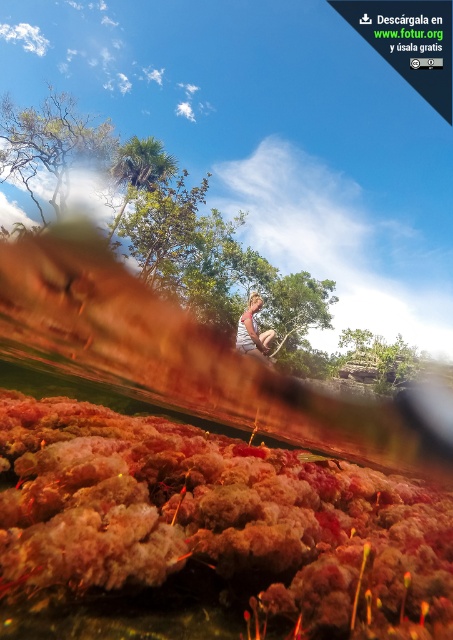
Question: Which object is farther from the camera taking this photo?

Choices:
 (A) fuzzy coral at bottom
 (B) green leafy tree at upper left
 (C) light brown hair at center
 (D) green leafy tree at upper center

Answer: (B)

Question: Which object is positioned farthest from the light brown hair at center?

Choices:
 (A) fuzzy coral at bottom
 (B) green leafy tree at upper center
 (C) green leafy tree at upper left

Answer: (C)

Question: Does fuzzy coral at bottom have a smaller size compared to light brown hair at center?

Choices:
 (A) no
 (B) yes

Answer: (B)

Question: Can you confirm if fuzzy coral at bottom is thinner than green leafy tree at upper left?

Choices:
 (A) yes
 (B) no

Answer: (A)

Question: Which point is farther from the camera taking this photo?

Choices:
 (A) (87, 582)
 (B) (129, 180)
 (C) (53, 93)

Answer: (C)

Question: Does fuzzy coral at bottom lie in front of green leafy tree at upper center?

Choices:
 (A) no
 (B) yes

Answer: (B)